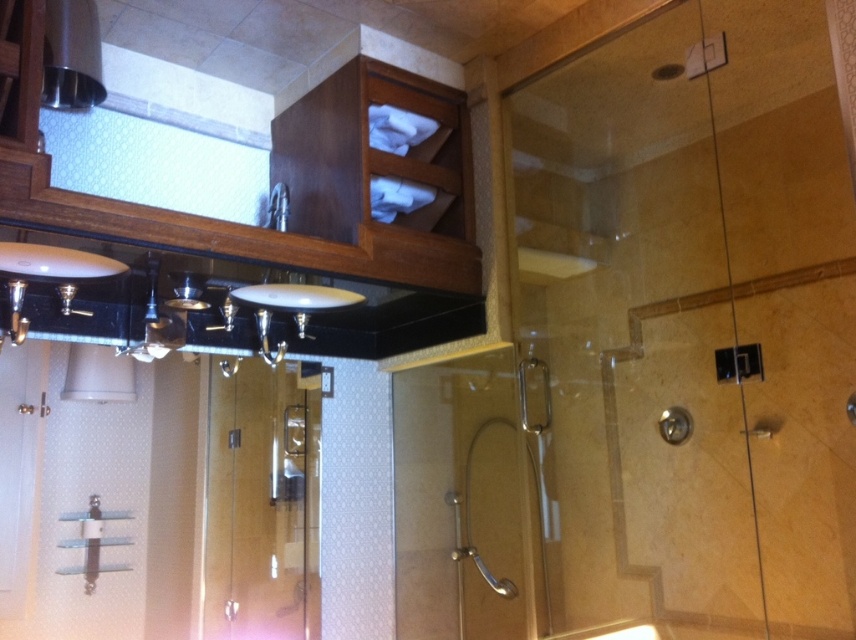
You are standing in the bathroom and want to wash your hands. The white glossy sink at center is where you need to go. However, there is a clear glass shower door at center in your way. Which direction should you move to avoid the shower door and reach the sink?

The clear glass shower door at center is to the right of the white glossy sink at center. To reach the sink, you should move to the left side of the shower door to avoid it and access the sink.

You are a plumber who needs to replace a pipe connecting the transparent glass shower door at center and the satin nickel faucet at upper center. The replacement pipe you have is 90 centimeters long. Will this pipe be sufficient to connect them?

The distance between the transparent glass shower door at center and the satin nickel faucet at upper center is 92.75 centimeters. The replacement pipe is only 90 centimeters long, which is shorter than the required distance. Therefore, the pipe will not be sufficient to connect them.